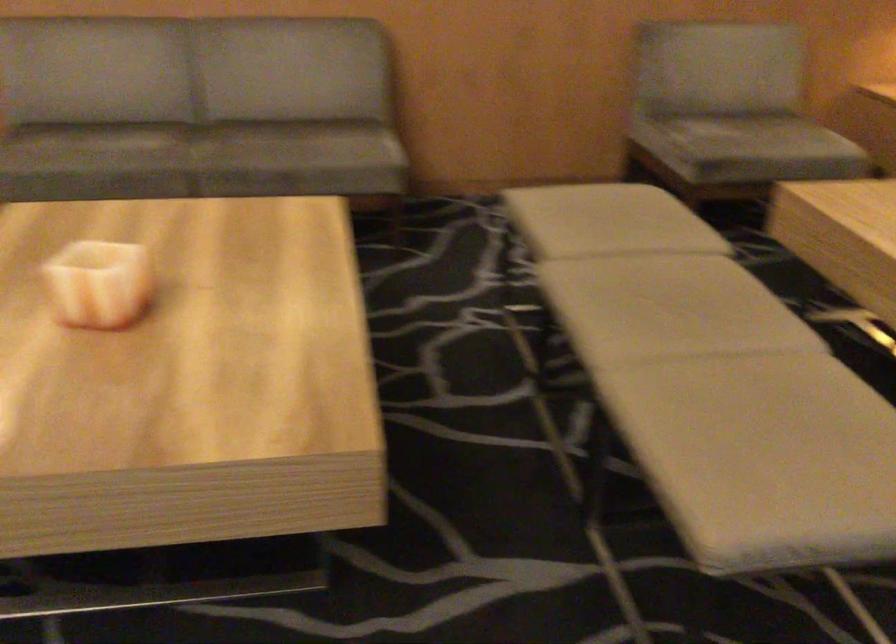
This screenshot has width=896, height=644. Describe the element at coordinates (712, 383) in the screenshot. I see `a bench sitting surface` at that location.